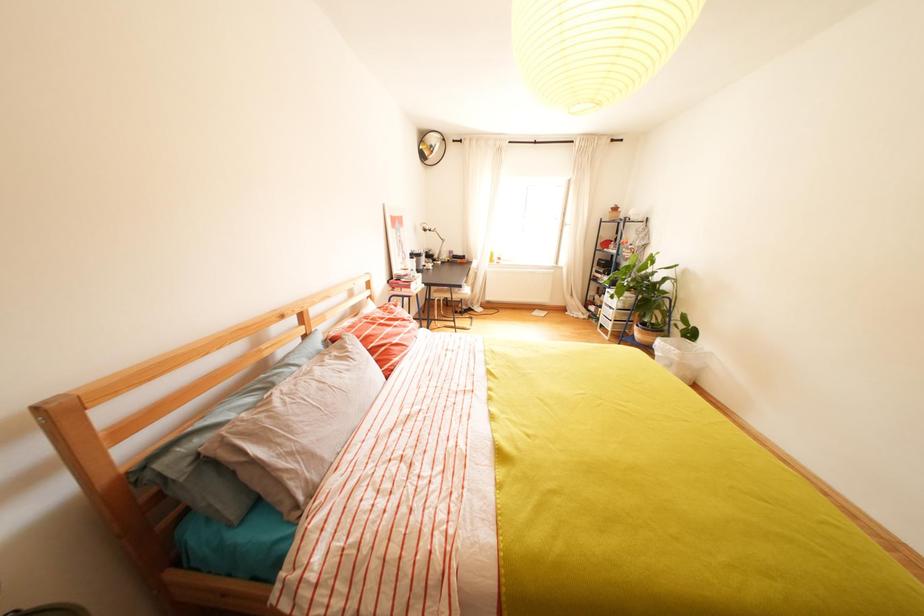
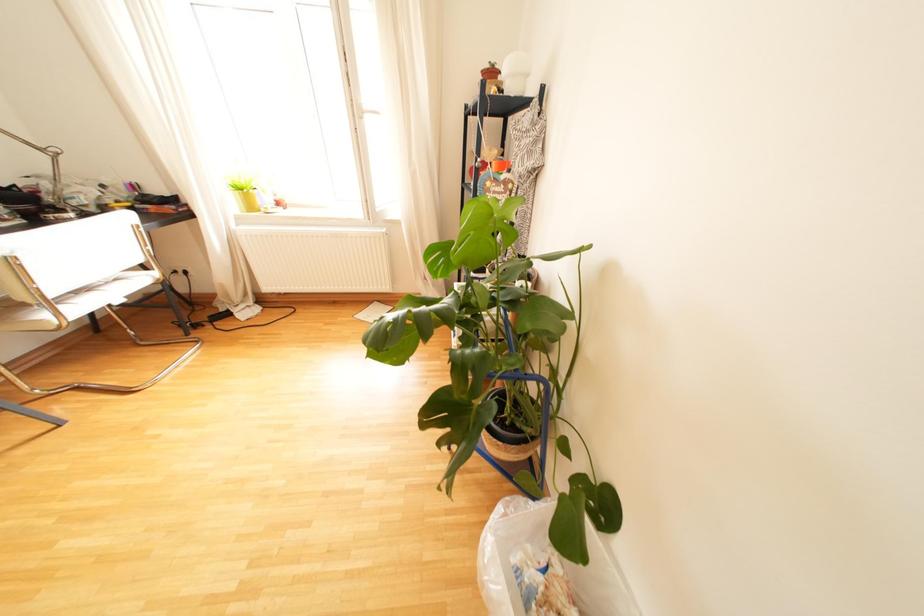
In a continuous first-person perspective shot, in which direction is the camera moving?

The movement direction of the cameraman is right, forward.